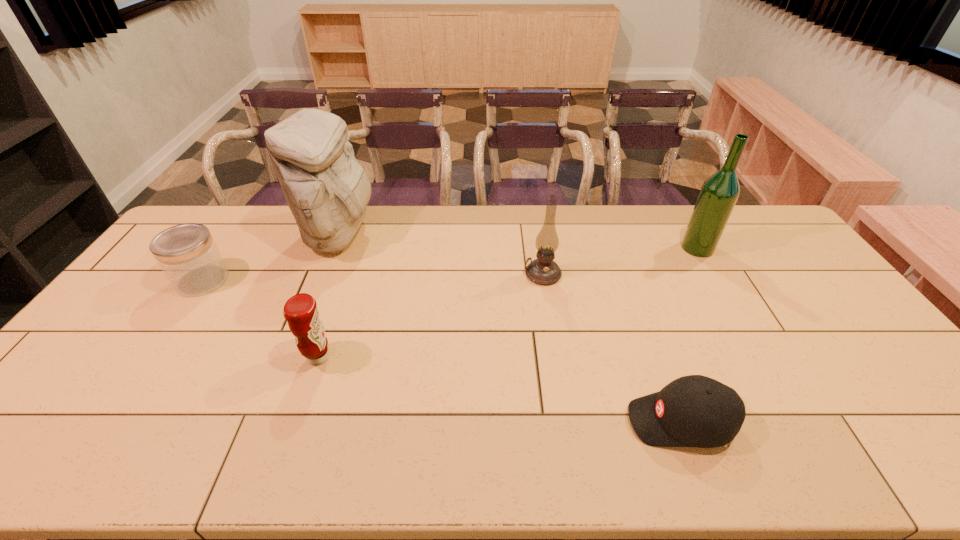
This screenshot has width=960, height=540. I want to click on free space located on the front-facing side of the backpack, so click(x=468, y=235).

Where is `blank area located on the right of the alcohol`? The height and width of the screenshot is (540, 960). blank area located on the right of the alcohol is located at coordinates (728, 248).

Identify the location of free region located 0.370m on the front of the oil lamp. The height and width of the screenshot is (540, 960). (561, 388).

What are the coordinates of `vacant region located 0.240m on the back of the condiment` in the screenshot? It's located at (344, 283).

Where is `vacant area situated on the right of the jar`? vacant area situated on the right of the jar is located at coordinates (272, 280).

This screenshot has width=960, height=540. In order to click on free spot located with a logo on the front of the fifth object from left to right in this screenshot , I will do `click(483, 422)`.

This screenshot has width=960, height=540. What are the coordinates of `vacant area located with a logo on the front of the fifth object from left to right` in the screenshot? It's located at tap(521, 422).

Image resolution: width=960 pixels, height=540 pixels. What are the coordinates of `vacant space located with a logo on the front of the fifth object from left to right` in the screenshot? It's located at (603, 422).

Image resolution: width=960 pixels, height=540 pixels. Identify the location of backpack located at the far edge. (327, 190).

Where is `alcohol that is at the far edge`? This screenshot has height=540, width=960. alcohol that is at the far edge is located at coordinates (719, 193).